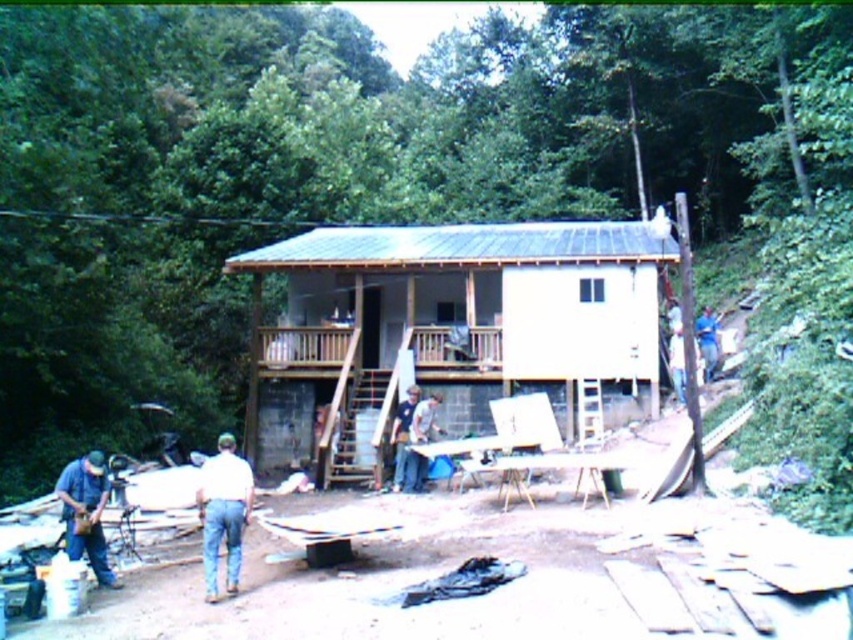
Is white cotton shirt at lower center to the left of denim shirt at lower left from the viewer's perspective?

No, white cotton shirt at lower center is not to the left of denim shirt at lower left.

Between white cotton shirt at lower center and denim shirt at lower left, which one has more height?

With more height is white cotton shirt at lower center.

What do you see at coordinates (223, 513) in the screenshot? I see `white cotton shirt at lower center` at bounding box center [223, 513].

The width and height of the screenshot is (853, 640). Find the location of `white cotton shirt at lower center`. white cotton shirt at lower center is located at coordinates (223, 513).

Between point (338, 336) and point (91, 504), which one is positioned behind?

Positioned behind is point (338, 336).

Is point (265, 332) closer to viewer compared to point (85, 460)?

No, (265, 332) is behind (85, 460).

Find the location of a particular element. brown wooden porch at center is located at coordinates (456, 348).

The width and height of the screenshot is (853, 640). I want to click on brown wooden porch at center, so click(456, 348).

Can you confirm if brown wooden porch at center is positioned above white cotton shirt at lower center?

Correct, brown wooden porch at center is located above white cotton shirt at lower center.

Does brown wooden porch at center have a lesser height compared to white cotton shirt at lower center?

Indeed, brown wooden porch at center has a lesser height compared to white cotton shirt at lower center.

Who is more distant from viewer, (310, 356) or (234, 464)?

The point (310, 356) is behind.

Locate an element on the screen. brown wooden porch at center is located at coordinates (456, 348).